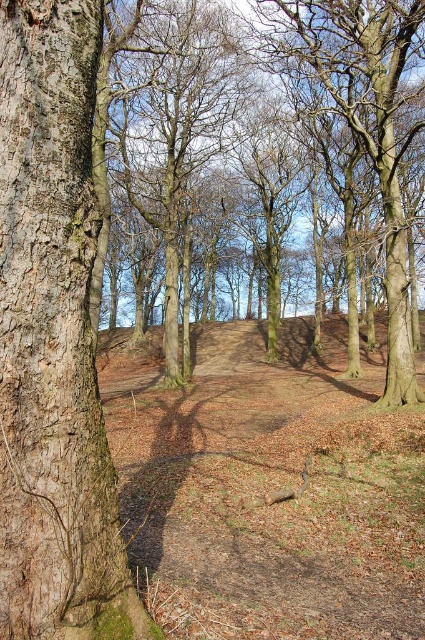
Question: Among these objects, which one is farthest from the camera?

Choices:
 (A) brown rough tree at center
 (B) smooth bark tree at upper center
 (C) smooth brown bark at left

Answer: (A)

Question: Is brown rough tree at center above smooth bark tree at upper center?

Choices:
 (A) yes
 (B) no

Answer: (B)

Question: Estimate the real-world distances between objects in this image. Which object is farther from the smooth brown bark at left?

Choices:
 (A) brown rough tree at center
 (B) smooth bark tree at upper center

Answer: (A)

Question: Which object is farther from the camera taking this photo?

Choices:
 (A) brown rough tree at center
 (B) smooth bark tree at upper center

Answer: (A)

Question: Where is smooth brown bark at left located in relation to brown rough tree at center in the image?

Choices:
 (A) right
 (B) left

Answer: (A)

Question: Does smooth brown bark at left lie behind smooth bark tree at upper center?

Choices:
 (A) no
 (B) yes

Answer: (A)